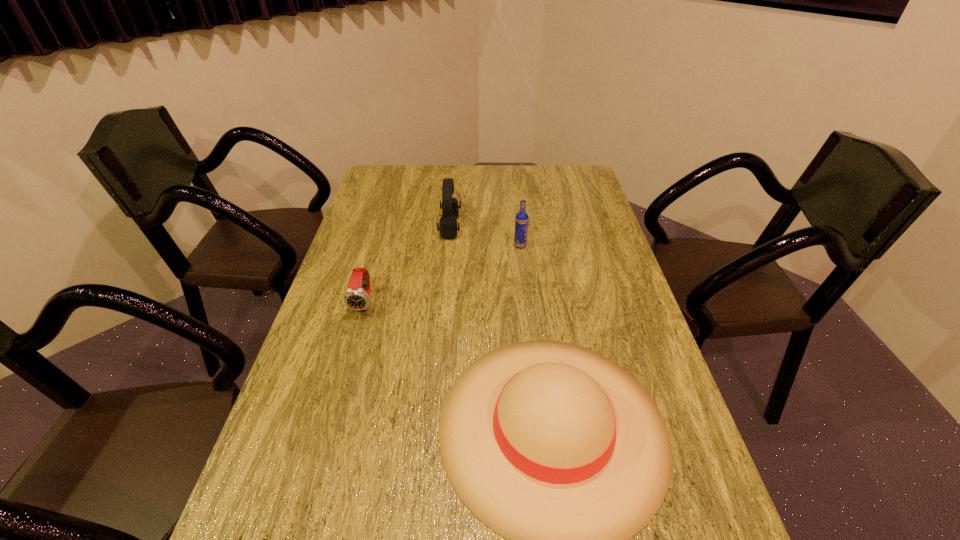
At what (x,y) coordinates should I click in order to perform the action: click on vacant space at the right edge. Please return your answer as a coordinate pair (x, y). This screenshot has width=960, height=540. Looking at the image, I should click on (581, 240).

This screenshot has width=960, height=540. Identify the location of vacant space at the far left corner. [390, 185].

What are the coordinates of `free space at the far right corner of the desktop` in the screenshot? It's located at (559, 183).

Locate an element on the screen. The height and width of the screenshot is (540, 960). vacant region between the farthest object and the second farthest object is located at coordinates (485, 237).

Identify the location of vacant point located between the second farthest object and the second nearest object. (443, 274).

You are a GUI agent. You are given a task and a screenshot of the screen. Output one action in this format:
    pyautogui.click(x=<x>, y=<y>)
    Task: Click on the free space between the shortest object and the vodka
    This screenshot has width=960, height=540.
    Given the screenshot: What is the action you would take?
    pyautogui.click(x=443, y=274)

You are a GUI agent. You are given a task and a screenshot of the screen. Output one action in this format:
    pyautogui.click(x=<x>, y=<y>)
    Task: Click on the object that is the second closest to the nearest object
    
    Given the screenshot: What is the action you would take?
    pyautogui.click(x=521, y=222)

Find the location of a particular element. The height and width of the screenshot is (540, 960). object that is the third closest one to the nearest object is located at coordinates (448, 228).

Identify the location of free space that satisfies the following two spatial constraints: 1. on the headband of the headset; 2. on the back side of the second farthest object. Image resolution: width=960 pixels, height=540 pixels. (448, 246).

The height and width of the screenshot is (540, 960). I want to click on free space that satisfies the following two spatial constraints: 1. on the headband of the vodka; 2. on the right side of the farthest object, so click(448, 246).